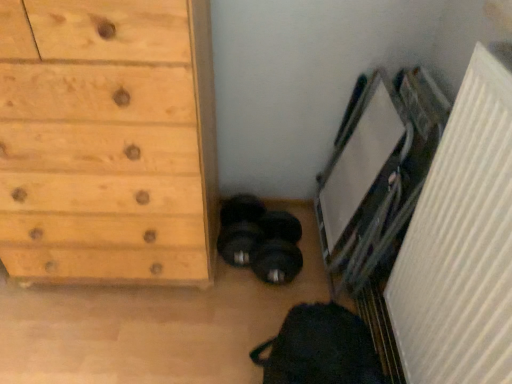
Question: From the image's perspective, is natural wood chest of drawers at left on top of white textured radiator at right?

Choices:
 (A) yes
 (B) no

Answer: (A)

Question: Is white textured radiator at right at the back of natural wood chest of drawers at left?

Choices:
 (A) yes
 (B) no

Answer: (B)

Question: Is natural wood chest of drawers at left smaller than white textured radiator at right?

Choices:
 (A) no
 (B) yes

Answer: (A)

Question: Is natural wood chest of drawers at left not inside white textured radiator at right?

Choices:
 (A) yes
 (B) no

Answer: (A)

Question: Is natural wood chest of drawers at left positioned behind white textured radiator at right?

Choices:
 (A) no
 (B) yes

Answer: (B)

Question: Can you confirm if natural wood chest of drawers at left is thinner than white textured radiator at right?

Choices:
 (A) yes
 (B) no

Answer: (B)

Question: Considering the relative positions of white textured radiator at right and natural wood chest of drawers at left in the image provided, is white textured radiator at right behind natural wood chest of drawers at left?

Choices:
 (A) no
 (B) yes

Answer: (A)

Question: Can you confirm if white textured radiator at right is smaller than natural wood chest of drawers at left?

Choices:
 (A) yes
 (B) no

Answer: (A)

Question: From a real-world perspective, is white textured radiator at right located beneath natural wood chest of drawers at left?

Choices:
 (A) no
 (B) yes

Answer: (A)

Question: From the image's perspective, is white textured radiator at right over natural wood chest of drawers at left?

Choices:
 (A) no
 (B) yes

Answer: (A)

Question: Is white textured radiator at right located outside natural wood chest of drawers at left?

Choices:
 (A) no
 (B) yes

Answer: (B)

Question: Is natural wood chest of drawers at left surrounded by white textured radiator at right?

Choices:
 (A) no
 (B) yes

Answer: (A)

Question: Considering the positions of point (454, 359) and point (54, 246), is point (454, 359) closer or farther from the camera than point (54, 246)?

Choices:
 (A) closer
 (B) farther

Answer: (A)